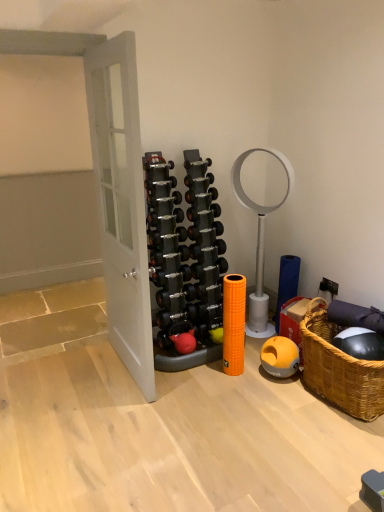
I want to click on black rubber dumbbell at center, the tenth dumbbell from the bottom, so click(x=204, y=229).

What is the approximate width of black rubber dumbbell at center, placed as the first dumbbell when sorted from top to bottom?

The width of black rubber dumbbell at center, placed as the first dumbbell when sorted from top to bottom, is 3.00 inches.

What do you see at coordinates (176, 297) in the screenshot? I see `black rubber dumbbell at center, which is the fourteenth dumbbell in top-to-bottom order` at bounding box center [176, 297].

I want to click on black rubber dumbbell at center, which is the fourteenth dumbbell in top-to-bottom order, so click(176, 297).

The image size is (384, 512). What do you see at coordinates (207, 249) in the screenshot? I see `black rubber dumbbell at center, which ranks as the 8th dumbbell in bottom-to-top order` at bounding box center [207, 249].

What are the coordinates of `white plastic mirror at center right` in the screenshot? It's located at (259, 242).

Is point (173, 341) closer to camera compared to point (175, 307)?

No, (173, 341) is behind (175, 307).

Considering the relative sizes of rubberized red kettlebell at center and black rubber dumbbell at center, the 3th dumbbell when ordered from bottom to top, in the image provided, is rubberized red kettlebell at center taller than black rubber dumbbell at center, the 3th dumbbell when ordered from bottom to top,?

Yes.

Considering the sizes of rubberized red kettlebell at center and black rubber dumbbell at center, which is the fourteenth dumbbell in top-to-bottom order, in the image, is rubberized red kettlebell at center bigger or smaller than black rubber dumbbell at center, which is the fourteenth dumbbell in top-to-bottom order,?

rubberized red kettlebell at center is bigger than black rubber dumbbell at center, which is the fourteenth dumbbell in top-to-bottom order.

From the image's perspective, is rubberized red kettlebell at center beneath black rubber dumbbell at center, the 3th dumbbell when ordered from bottom to top?

Yes.

Is black rubber dumbbell at center, the twelfth dumbbell from the bottom, thinner than matte black dumbbell at center, acting as the 2th dumbbell starting from the bottom?

Yes, black rubber dumbbell at center, the twelfth dumbbell from the bottom, is thinner than matte black dumbbell at center, acting as the 2th dumbbell starting from the bottom.

Choose the correct answer: Is black rubber dumbbell at center, marked as the 5th dumbbell in a top-to-bottom arrangement, inside matte black dumbbell at center, acting as the 2th dumbbell starting from the bottom, or outside it?

The correct answer is: outside.

Which point is more forward, (214, 208) or (168, 327)?

The point (214, 208) is in front.

Which is more to the left, black rubber dumbbell at center, marked as the 5th dumbbell in a top-to-bottom arrangement, or matte black dumbbell at center, the fifteenth dumbbell viewed from the top?

matte black dumbbell at center, the fifteenth dumbbell viewed from the top, is more to the left.

From the picture: From a real-world perspective, between black rubber dumbbell at center, which ranks as the 8th dumbbell in bottom-to-top order, and white plastic mirror at center right, who is vertically higher?

black rubber dumbbell at center, which ranks as the 8th dumbbell in bottom-to-top order.

In the scene shown: Does black rubber dumbbell at center, which ranks as the 9th dumbbell in top-to-bottom order, appear on the left side of white plastic mirror at center right?

Indeed, black rubber dumbbell at center, which ranks as the 9th dumbbell in top-to-bottom order, is positioned on the left side of white plastic mirror at center right.

Can white plastic mirror at center right be found inside black rubber dumbbell at center, which ranks as the 8th dumbbell in bottom-to-top order?

No, white plastic mirror at center right is not surrounded by black rubber dumbbell at center, which ranks as the 8th dumbbell in bottom-to-top order.

In the image, is black rubber dumbbell at center, which ranks as the 8th dumbbell in bottom-to-top order, positioned in front of or behind white plastic mirror at center right?

Visually, black rubber dumbbell at center, which ranks as the 8th dumbbell in bottom-to-top order, is located behind white plastic mirror at center right.

Based on the photo, looking at their sizes, would you say silver metallic dumbbell at center, which is the 14th dumbbell in bottom-to-top order, is wider or thinner than brown woven picnic basket at lower right?

silver metallic dumbbell at center, which is the 14th dumbbell in bottom-to-top order, is thinner than brown woven picnic basket at lower right.

From the image's perspective, is silver metallic dumbbell at center, which is the 14th dumbbell in bottom-to-top order, beneath brown woven picnic basket at lower right?

No, from the image's perspective, silver metallic dumbbell at center, which is the 14th dumbbell in bottom-to-top order, is not beneath brown woven picnic basket at lower right.

Can you confirm if silver metallic dumbbell at center, which is counted as the third dumbbell, starting from the top, is bigger than brown woven picnic basket at lower right?

Incorrect, silver metallic dumbbell at center, which is counted as the third dumbbell, starting from the top, is not larger than brown woven picnic basket at lower right.

Looking at this image, are silver metallic dumbbell at center, which is counted as the third dumbbell, starting from the top, and brown woven picnic basket at lower right making contact?

No.

Can you tell me how much orange rubber dumbbell at center, the 12th dumbbell positioned from the top, and black rubber dumbbell at center, placed as the first dumbbell when sorted from top to bottom, differ in facing direction?

orange rubber dumbbell at center, the 12th dumbbell positioned from the top, and black rubber dumbbell at center, placed as the first dumbbell when sorted from top to bottom, are facing 2.7 degrees away from each other.

Who is more distant, orange rubber dumbbell at center, the 12th dumbbell positioned from the top, or black rubber dumbbell at center, the sixteenth dumbbell positioned from the bottom?

orange rubber dumbbell at center, the 12th dumbbell positioned from the top, is behind.

From a real-world perspective, relative to black rubber dumbbell at center, placed as the first dumbbell when sorted from top to bottom, is orange rubber dumbbell at center, the 12th dumbbell positioned from the top, vertically above or below?

From a real-world perspective, orange rubber dumbbell at center, the 12th dumbbell positioned from the top, is physically below black rubber dumbbell at center, placed as the first dumbbell when sorted from top to bottom.

Is point (223, 260) in front of point (195, 187)?

No, (223, 260) is further to viewer.

This screenshot has width=384, height=512. Find the location of `the 3rd dumbbell behind the black rubber dumbbell at center, which ranks as the fourth dumbbell in bottom-to-top order`. the 3rd dumbbell behind the black rubber dumbbell at center, which ranks as the fourth dumbbell in bottom-to-top order is located at coordinates (192, 196).

Is silver metallic dumbbell at center, which is counted as the third dumbbell, starting from the top, inside the boundaries of black rubber dumbbell at center, which ranks as the fourth dumbbell in bottom-to-top order, or outside?

silver metallic dumbbell at center, which is counted as the third dumbbell, starting from the top, is outside black rubber dumbbell at center, which ranks as the fourth dumbbell in bottom-to-top order.

Which object is positioned more to the left, silver metallic dumbbell at center, which is the 14th dumbbell in bottom-to-top order, or black rubber dumbbell at center, which ranks as the fourth dumbbell in bottom-to-top order?

black rubber dumbbell at center, which ranks as the fourth dumbbell in bottom-to-top order.

In terms of height, does silver metallic dumbbell at center, which is counted as the third dumbbell, starting from the top, look taller or shorter compared to white plastic mirror at center right?

Clearly, silver metallic dumbbell at center, which is counted as the third dumbbell, starting from the top, is shorter compared to white plastic mirror at center right.

Are silver metallic dumbbell at center, which is counted as the third dumbbell, starting from the top, and white plastic mirror at center right making contact?

No, silver metallic dumbbell at center, which is counted as the third dumbbell, starting from the top, is not beside white plastic mirror at center right.

Considering the positions of objects silver metallic dumbbell at center, which is the 14th dumbbell in bottom-to-top order, and white plastic mirror at center right in the image provided, who is in front, silver metallic dumbbell at center, which is the 14th dumbbell in bottom-to-top order, or white plastic mirror at center right?

white plastic mirror at center right is in front.

Locate an element on the screen. The image size is (384, 512). the 2nd dumbbell in front when counting from the rubberized red kettlebell at center is located at coordinates (176, 297).

You are a GUI agent. You are given a task and a screenshot of the screen. Output one action in this format:
    pyautogui.click(x=<x>, y=<y>)
    Task: Click on the 4th dumbbell to the right of the matte black dumbbell at center, acting as the 2th dumbbell starting from the bottom, starting your count from the anchor
    This screenshot has width=384, height=512.
    Given the screenshot: What is the action you would take?
    pyautogui.click(x=203, y=210)

When comparing their distances from silver metallic dumbbell at center, which is the 14th dumbbell in bottom-to-top order, does black rubber dumbbell at center, which is the fourteenth dumbbell in top-to-bottom order, or brown woven picnic basket at lower right seem closer?

Among the two, black rubber dumbbell at center, which is the fourteenth dumbbell in top-to-bottom order, is located nearer to silver metallic dumbbell at center, which is the 14th dumbbell in bottom-to-top order.

Based on their spatial positions, is white matte door at left or silver metallic dumbbell at center, which is counted as the third dumbbell, starting from the top, closer to black rubber dumbbell at center, the twelfth dumbbell from the bottom?

The object closer to black rubber dumbbell at center, the twelfth dumbbell from the bottom, is silver metallic dumbbell at center, which is counted as the third dumbbell, starting from the top.

Which object lies nearer to the anchor point matte black dumbbell at center, acting as the 2th dumbbell starting from the bottom, black rubber dumbbell at center, the tenth dumbbell from the bottom, or black rubber dumbbell at center, which is the fourteenth dumbbell in top-to-bottom order?

black rubber dumbbell at center, which is the fourteenth dumbbell in top-to-bottom order.

In the scene shown: Looking at the image, which one is located closer to black rubber dumbbell at center, marked as the sixth dumbbell in a top-to-bottom arrangement, silver metallic dumbbell at center, which is the 14th dumbbell in bottom-to-top order, or rubberized red kettlebell at center?

Based on the image, silver metallic dumbbell at center, which is the 14th dumbbell in bottom-to-top order, appears to be nearer to black rubber dumbbell at center, marked as the sixth dumbbell in a top-to-bottom arrangement.

Estimate the real-world distances between objects in this image. Which object is further from black rubber dumbbell at center, marked as the sixth dumbbell in a top-to-bottom arrangement, black rubber dumbbell at center, which is counted as the fifteenth dumbbell, starting from the bottom, or black rubber dumbbell at center, which ranks as the 8th dumbbell in bottom-to-top order?

The object further to black rubber dumbbell at center, marked as the sixth dumbbell in a top-to-bottom arrangement, is black rubber dumbbell at center, which ranks as the 8th dumbbell in bottom-to-top order.

From the image, which object appears to be farther from black rubber dumbbell at center, the second dumbbell positioned from the top, rubberized red kettlebell at center or white plastic mirror at center right?

The object further to black rubber dumbbell at center, the second dumbbell positioned from the top, is rubberized red kettlebell at center.

Considering their positions, is black rubber dumbbell at center, the second dumbbell positioned from the top, positioned closer to white plastic mirror at center right than black rubber dumbbell at center, placed as the first dumbbell when sorted from top to bottom?

black rubber dumbbell at center, placed as the first dumbbell when sorted from top to bottom.

Estimate the real-world distances between objects in this image. Which object is further from black rubber dumbbell at center, the sixteenth dumbbell positioned from the bottom, black rubber dumbbell at center, the 3th dumbbell when ordered from bottom to top, or black rubber dumbbell at center, the second dumbbell positioned from the top?

black rubber dumbbell at center, the 3th dumbbell when ordered from bottom to top, is further to black rubber dumbbell at center, the sixteenth dumbbell positioned from the bottom.

Find the location of a particular element. mirror between white matte door at left and orange rubber dumbbell at center, the 12th dumbbell positioned from the top, from front to back is located at coordinates (259, 242).

Where is `toy that lies between black rubber dumbbell at center, arranged as the 9th dumbbell when ordered from the bottom, and orange rubber dumbbell at lower right, the 1th dumbbell from the bottom, from top to bottom`? toy that lies between black rubber dumbbell at center, arranged as the 9th dumbbell when ordered from the bottom, and orange rubber dumbbell at lower right, the 1th dumbbell from the bottom, from top to bottom is located at coordinates (184, 342).

You are a GUI agent. You are given a task and a screenshot of the screen. Output one action in this format:
    pyautogui.click(x=<x>, y=<y>)
    Task: Click on the toy situated between black rubber dumbbell at center, which is the fourteenth dumbbell in top-to-bottom order, and brown woven picnic basket at lower right from left to right
    The width and height of the screenshot is (384, 512).
    Given the screenshot: What is the action you would take?
    pyautogui.click(x=184, y=342)

This screenshot has height=512, width=384. Find the location of `toy located between white matte door at left and black rubber dumbbell at center, which ranks as the 9th dumbbell in top-to-bottom order, in the depth direction`. toy located between white matte door at left and black rubber dumbbell at center, which ranks as the 9th dumbbell in top-to-bottom order, in the depth direction is located at coordinates (184, 342).